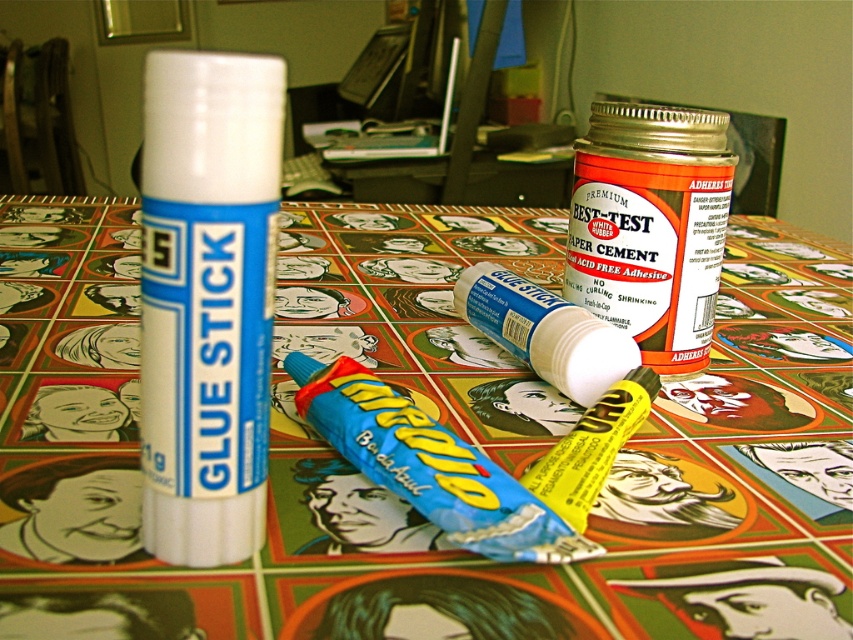
Does multicolored printed paper at center lie in front of blue plastic tube at center?

Yes, it is in front of blue plastic tube at center.

The image size is (853, 640). Describe the element at coordinates (440, 422) in the screenshot. I see `multicolored printed paper at center` at that location.

You are a GUI agent. You are given a task and a screenshot of the screen. Output one action in this format:
    pyautogui.click(x=<x>, y=<y>)
    Task: Click on the multicolored printed paper at center
    This screenshot has height=640, width=853.
    Given the screenshot: What is the action you would take?
    pyautogui.click(x=440, y=422)

Is point (242, 403) positioned after point (618, 337)?

No.

The image size is (853, 640). What do you see at coordinates (207, 300) in the screenshot?
I see `white matte glue stick at center` at bounding box center [207, 300].

Is point (258, 147) behind point (526, 342)?

No.

Where is `white matte glue stick at center`? This screenshot has width=853, height=640. white matte glue stick at center is located at coordinates (207, 300).

Is multicolored printed paper at center to the right of yellow matte lip balm at center from the viewer's perspective?

Incorrect, multicolored printed paper at center is not on the right side of yellow matte lip balm at center.

Looking at this image, does multicolored printed paper at center have a smaller size compared to yellow matte lip balm at center?

Actually, multicolored printed paper at center might be larger than yellow matte lip balm at center.

Does point (682, 564) come closer to viewer compared to point (590, 280)?

That is True.

Where is `multicolored printed paper at center`? multicolored printed paper at center is located at coordinates (440, 422).